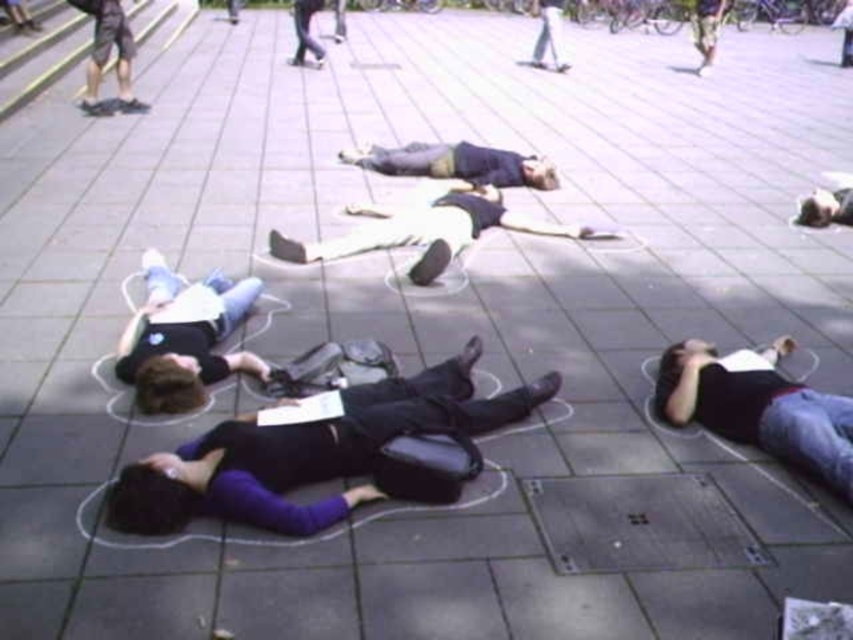
You are an artist planning to add a new chalk outline around the dark blue jeans at lower right and the light beige pants at center. Which of the two objects should you draw the outline around first to ensure proper layering?

You should draw the outline around the dark blue jeans at lower right first because it is positioned under the light beige pants at center, so layering it first allows the beige pants to appear on top.

You are standing at the origin point in the plaza and see two points marked on the ground. Which point is closer to you, point (x=149, y=292) or point (x=532, y=221)?

Point (x=149, y=292) is in front of point (x=532, y=221), so it is closer to you.